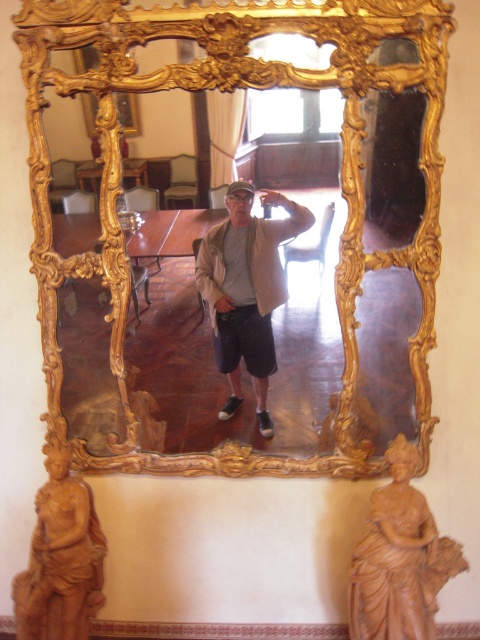
Based on the photo, you are a delivery person who needs to place a package between the gold ornate mirror at center and the brown wood statue at lower right. The package requires 20 inches of space. Can you fit it there?

The distance between the gold ornate mirror at center and the brown wood statue at lower right is 24.22 inches, which is more than enough to fit the package requiring 20 inches of space.

You are standing in front of the large ornate mirror and want to place a small vase on the floor next to the brown wood statue at lower right. Based on the mirror reflection, where should you place the vase in the real room?

The brown wood statue at lower right is located at point (399, 557) in the mirror reflection. In the real room, you should place the vase at the mirrored coordinates, which would be point (399, 81) to be next to it.

In the scene shown: You are standing in the room and want to place a 24 inch wide decorative box between the gold ornate mirror at center and the brown terracotta statue at lower left. Can the box fit in the space between them?

The distance between the gold ornate mirror at center and the brown terracotta statue at lower left is 24.73 inches, so the 24 inch wide decorative box can fit in the space between them.